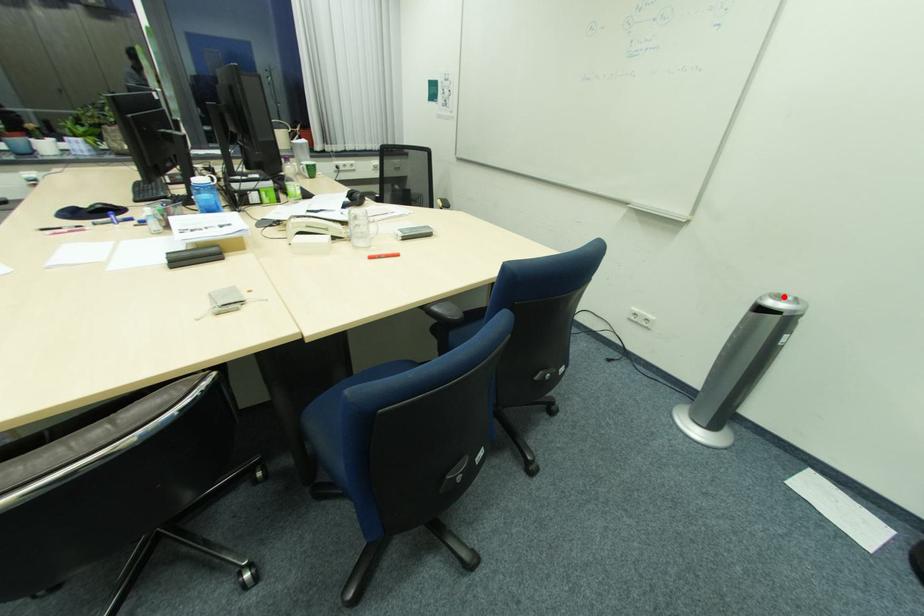
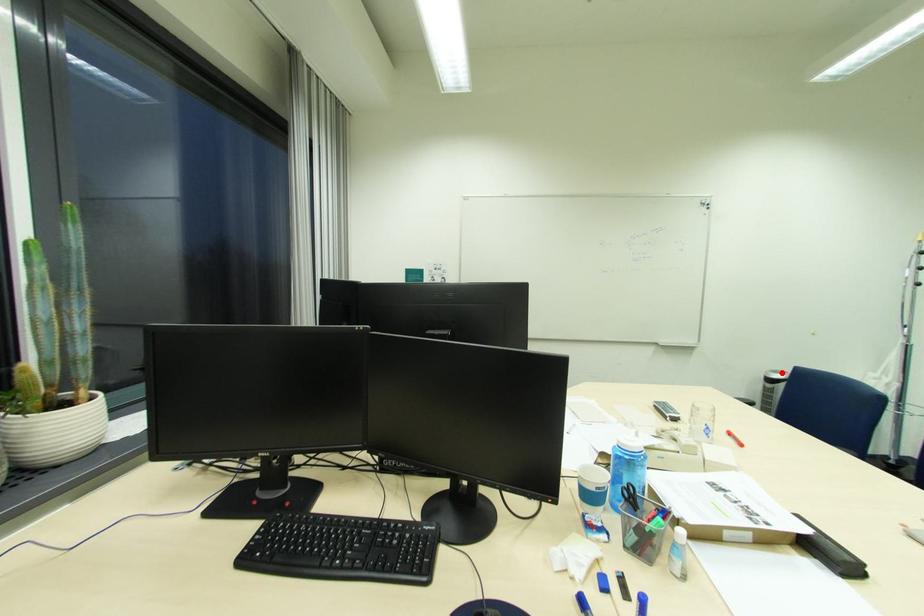
I am providing you with two images of the same scene from different viewpoints. A red point is marked on the first image and another point is marked on the second image. Do the highlighted points in image1 and image2 indicate the same real-world spot?

Yes